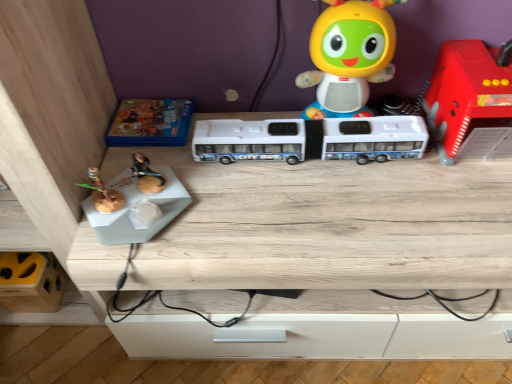
This screenshot has height=384, width=512. I want to click on vacant area in front of rubberized red fire truck at right, which is the 1th toy in right-to-left order, so click(470, 203).